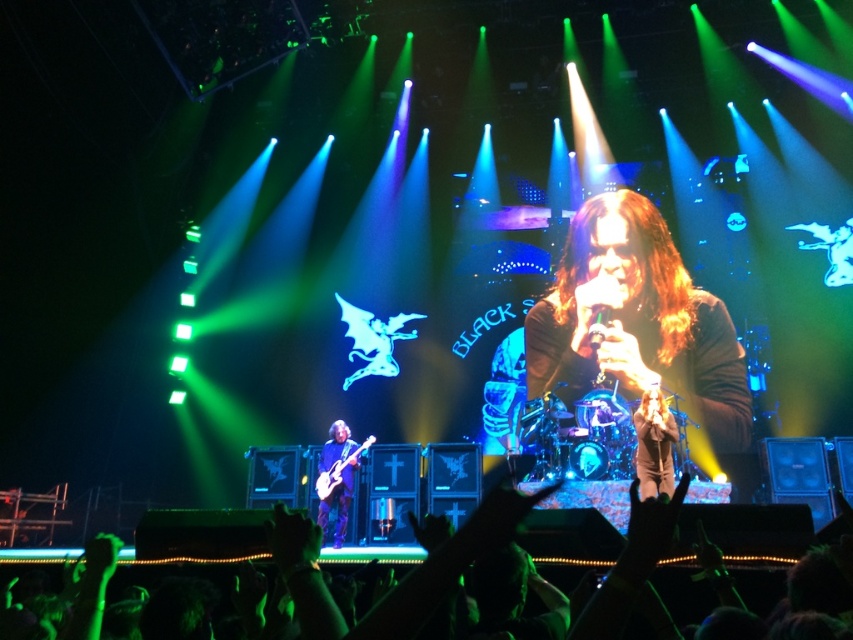
Which of these two, shiny brown guitar at lower left or shiny metallic guitar at lower center, stands taller?

shiny brown guitar at lower left

Who is lower down, shiny brown guitar at lower left or shiny metallic guitar at lower center?

shiny brown guitar at lower left is below.

Between point (351, 492) and point (329, 486), which one is positioned behind?

The point (351, 492) is more distant.

The image size is (853, 640). Identify the location of shiny brown guitar at lower left. [x=335, y=477].

Between shiny brown hair at center and shiny brown guitar at lower left, which one is positioned higher?

shiny brown hair at center is higher up.

Who is shorter, shiny brown hair at center or shiny brown guitar at lower left?

Standing shorter between the two is shiny brown guitar at lower left.

Describe the element at coordinates (640, 324) in the screenshot. The image size is (853, 640). I see `shiny brown hair at center` at that location.

At what (x,y) coordinates should I click in order to perform the action: click on shiny brown hair at center. Please return your answer as a coordinate pair (x, y). This screenshot has height=640, width=853. Looking at the image, I should click on (640, 324).

Which of these two, shiny brown hair at center or shiny metallic guitar at lower center, stands shorter?

Standing shorter between the two is shiny metallic guitar at lower center.

Is shiny brown hair at center bigger than shiny metallic guitar at lower center?

Correct, shiny brown hair at center is larger in size than shiny metallic guitar at lower center.

Between point (610, 224) and point (334, 461), which one is positioned in front?

Point (610, 224) is in front.

At what (x,y) coordinates should I click in order to perform the action: click on shiny brown hair at center. Please return your answer as a coordinate pair (x, y). Looking at the image, I should click on 640,324.